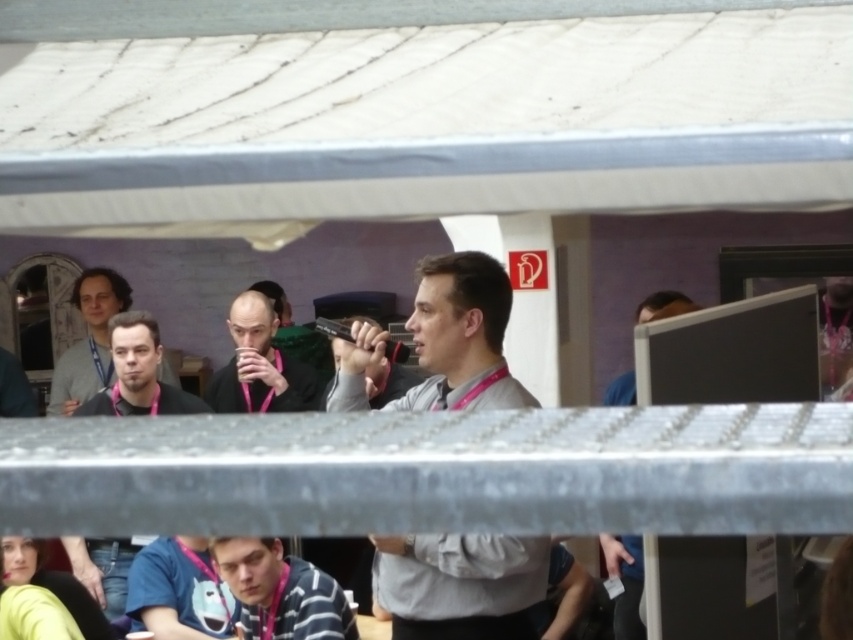
You are an event organizer looking at the image. You need to locate the matte black mug at center and the gray fabric shirt at center. From the perspective of someone standing behind the metal railing in the foreground, which object is positioned to the right?

The gray fabric shirt at center is to the right of the matte black mug at center.

You are an event organizer who needs to ensure all participants have proper attire. You notice two shirts in the image, the gray fabric shirt at center and the striped cotton shirt at lower center. Which shirt is bigger in size?

The gray fabric shirt at center is larger in size than the striped cotton shirt at lower center.